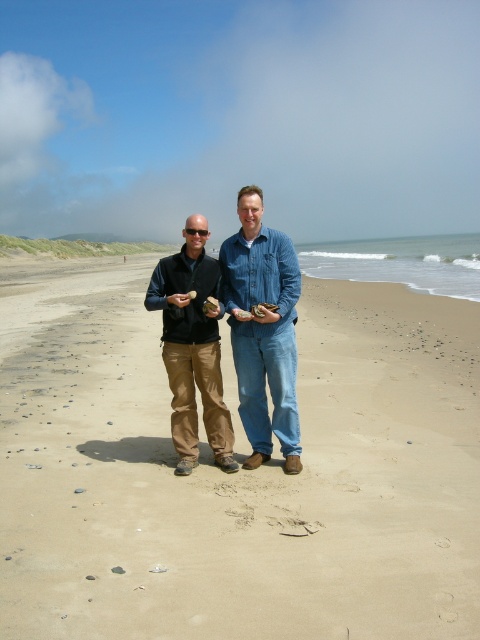
You are a photographer trying to capture a photo of the smooth sand at center and the denim jeans at center. Based on their positions, which object should you focus on first to ensure both are in the frame?

The smooth sand at center is in front of the denim jeans at center, so you should focus on the denim jeans at center first to ensure both are in the frame.